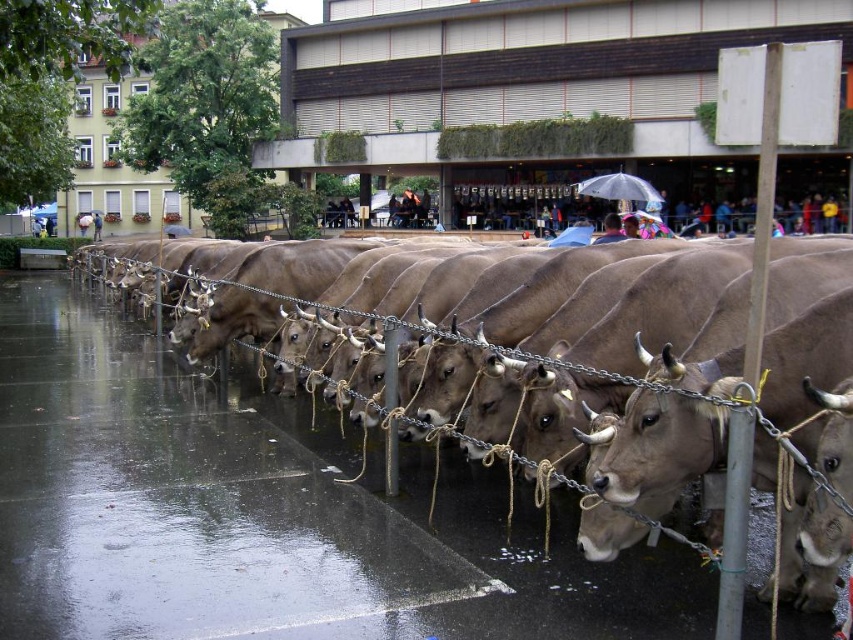
Question: Can you confirm if brown smooth pavement at center is bigger than transparent plastic umbrella at center?

Choices:
 (A) yes
 (B) no

Answer: (B)

Question: Is brown smooth pavement at center closer to camera compared to transparent plastic umbrella at center?

Choices:
 (A) no
 (B) yes

Answer: (B)

Question: Is brown smooth pavement at center to the left of transparent plastic umbrella at center from the viewer's perspective?

Choices:
 (A) no
 (B) yes

Answer: (B)

Question: Which point is farther to the camera?

Choices:
 (A) tap(231, 392)
 (B) tap(613, 188)

Answer: (B)